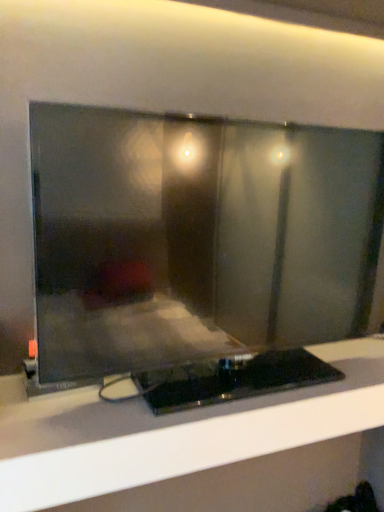
Question: Is matte black monitor at center wider or thinner than black glossy tv stand at center?

Choices:
 (A) wide
 (B) thin

Answer: (B)

Question: Visually, is matte black monitor at center positioned to the left or to the right of black glossy tv stand at center?

Choices:
 (A) right
 (B) left

Answer: (B)

Question: Is matte black monitor at center inside the boundaries of black glossy tv stand at center, or outside?

Choices:
 (A) outside
 (B) inside

Answer: (A)

Question: Is black glossy tv stand at center wider or thinner than matte black monitor at center?

Choices:
 (A) thin
 (B) wide

Answer: (B)

Question: From their relative heights in the image, would you say black glossy tv stand at center is taller or shorter than matte black monitor at center?

Choices:
 (A) short
 (B) tall

Answer: (A)

Question: Is point (349, 397) closer or farther from the camera than point (198, 150)?

Choices:
 (A) farther
 (B) closer

Answer: (A)

Question: From a real-world perspective, is black glossy tv stand at center physically located above or below matte black monitor at center?

Choices:
 (A) above
 (B) below

Answer: (B)